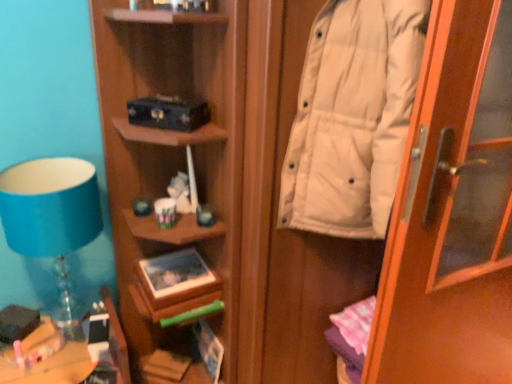
Question: From a real-world perspective, relative to white matte door at right, is matte blue book at lower center, the 3th book from the top, vertically above or below?

Choices:
 (A) below
 (B) above

Answer: (A)

Question: Considering their positions, is matte blue book at lower center, the 3th book from the top, located in front of or behind white matte door at right?

Choices:
 (A) front
 (B) behind

Answer: (B)

Question: Considering the real-world distances, which object is farthest from the matte black book at upper center, which is counted as the fourth book, starting from the bottom?

Choices:
 (A) hardcover book at lower center, acting as the 4th book starting from the top
 (B) matte blue book at lower center, marked as the second book in a bottom-to-top arrangement
 (C) wooden desk at lower left
 (D) white matte coat at right
 (E) white matte door at right

Answer: (A)

Question: Which is farther from the white matte door at right?

Choices:
 (A) matte blue book at lower center, marked as the second book in a bottom-to-top arrangement
 (B) matte black book at upper center, which is counted as the fourth book, starting from the bottom
 (C) matte green book at center, the 3th book in the bottom-to-top sequence
 (D) hardcover book at lower center, acting as the 4th book starting from the top
 (E) wooden desk at lower left

Answer: (D)